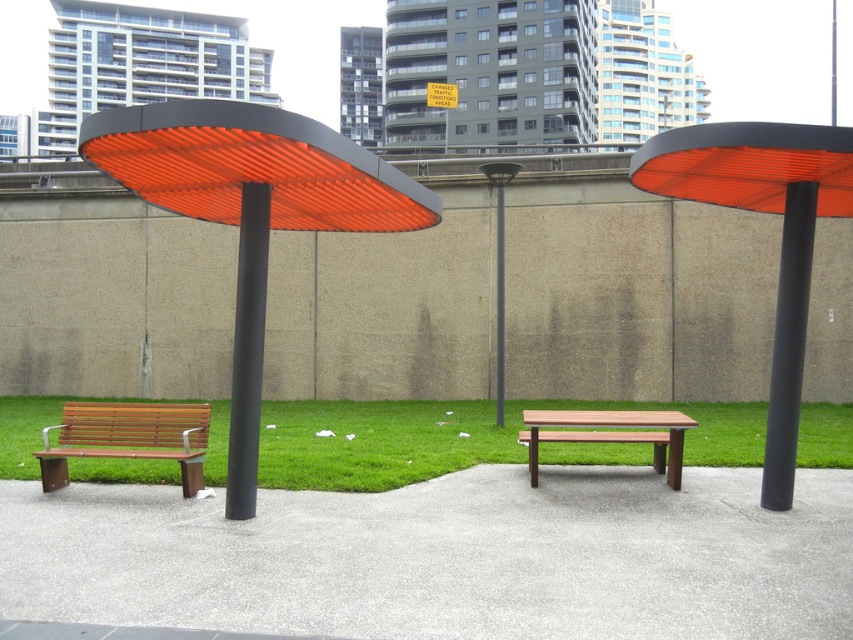
Question: Is orange matte canopy at center smaller than orange matte umbrella at right?

Choices:
 (A) no
 (B) yes

Answer: (B)

Question: Where is orange matte umbrella at right located in relation to black metal pole at center in the image?

Choices:
 (A) left
 (B) right

Answer: (B)

Question: Among these points, which one is nearest to the camera?

Choices:
 (A) (527, 442)
 (B) (833, 188)
 (C) (48, 456)
 (D) (799, 339)

Answer: (D)

Question: Which point appears closest to the camera in this image?

Choices:
 (A) (236, 392)
 (B) (148, 193)
 (C) (808, 228)
 (D) (173, 116)

Answer: (D)

Question: Which object is farther from the camera taking this photo?

Choices:
 (A) black metal pole at center
 (B) green grass at lower center
 (C) orange matte umbrella at right

Answer: (A)

Question: Is orange corrugated plastic umbrella at left to the left of orange matte umbrella at right from the viewer's perspective?

Choices:
 (A) no
 (B) yes

Answer: (B)